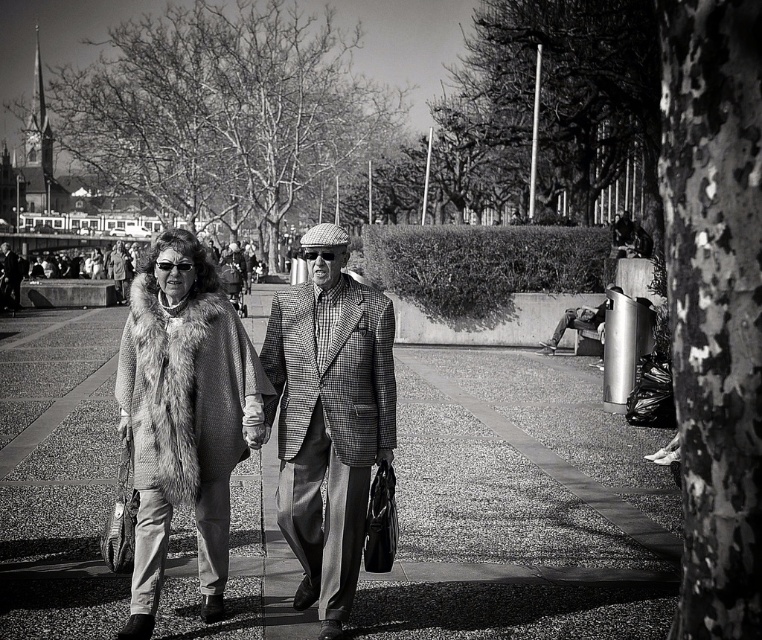
You are a photographer trying to capture the two people walking in the square. You want to focus on the fuzzy fur coat at center but also include the smooth concrete pavement at center in the shot. Can you position yourself so that both are visible without moving the subjects?

The smooth concrete pavement at center is further to the viewer than the fuzzy fur coat at center, so positioning yourself behind the subjects would allow both the fuzzy fur coat at center and the smooth concrete pavement at center to be in the frame.

You are a photographer trying to capture a closeup of the houndstooth fabric jacket at center while standing on the smooth concrete pavement at center. Can you fit both the jacket and the pavement into your camera frame at the same time?

The smooth concrete pavement at center is bigger than the houndstooth fabric jacket at center, so yes, the camera frame can fit both the jacket and the pavement since the pavement is larger and can accommodate the smaller jacket within it.

You are a delivery drone that needs to land on the smooth concrete pavement at center. However, there is a houndstooth fabric jacket at center in the way. Can you safely land on the pavement without hitting the jacket?

The smooth concrete pavement at center has a lesser height compared to the houndstooth fabric jacket at center, so the drone should be able to land on the pavement as long as it can navigate around or above the jacket to avoid collision.